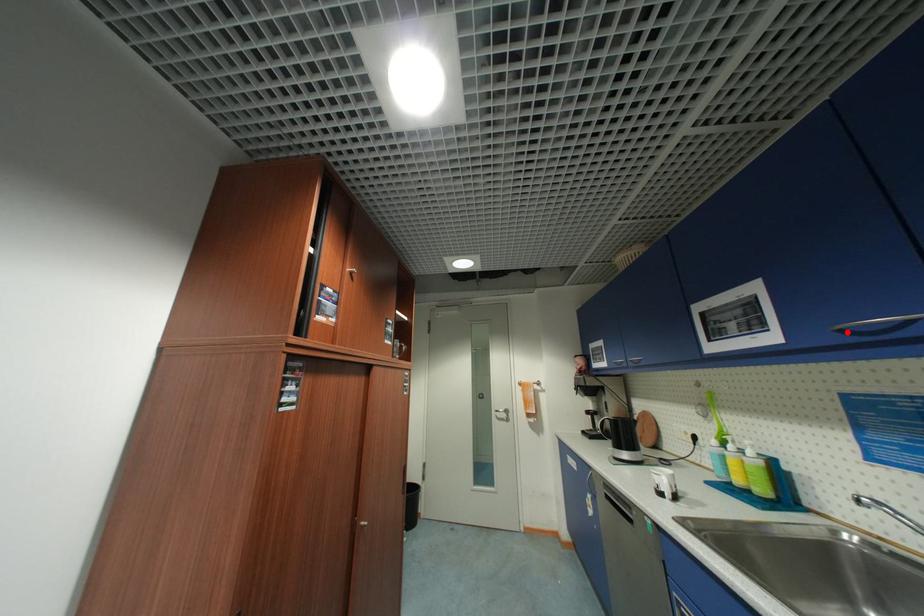
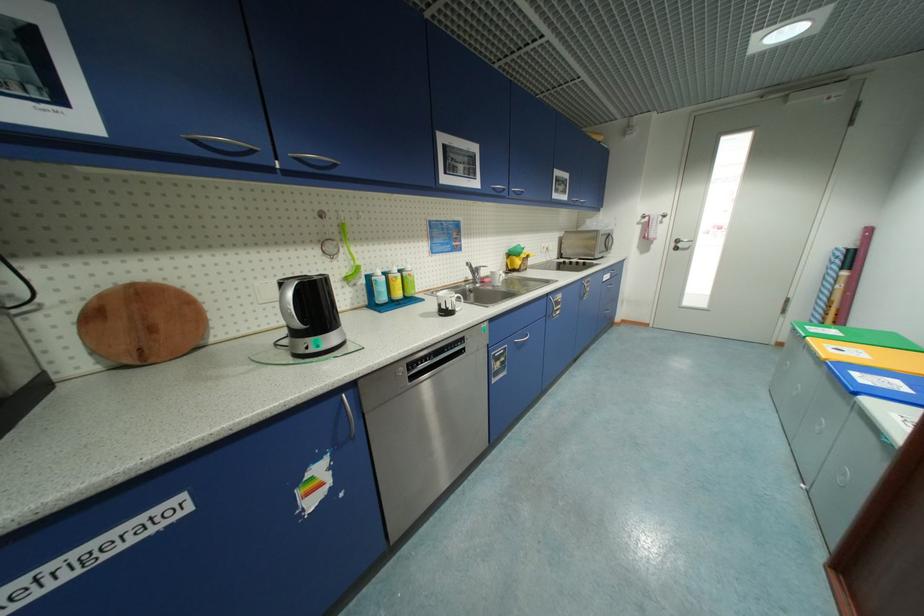
Question: I am providing you with two images of the same scene from different viewpoints. A red point is marked on the first image. At the location where the point appears in image 1, is it still visible in image 2?

Choices:
 (A) Yes
 (B) No

Answer: (A)